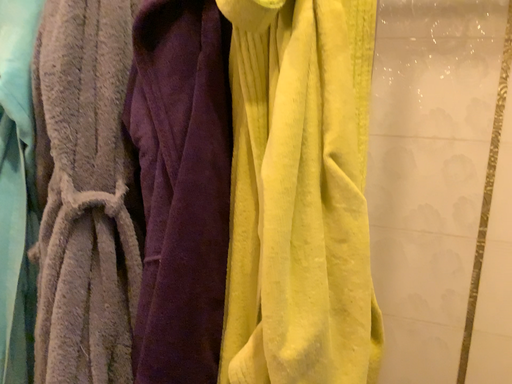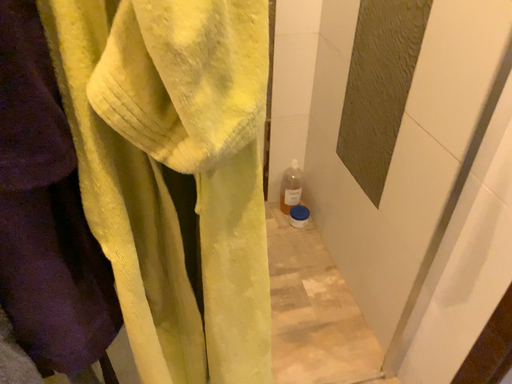
Question: How did the camera likely rotate when shooting the video?

Choices:
 (A) rotated right
 (B) rotated left

Answer: (A)